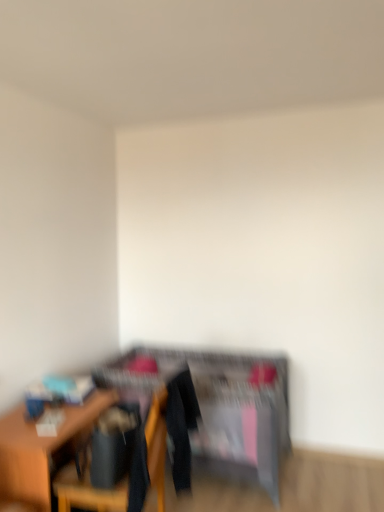
Question: Are wooden chair at lower left and wooden table at left making contact?

Choices:
 (A) no
 (B) yes

Answer: (A)

Question: Does wooden chair at lower left have a greater height compared to wooden table at left?

Choices:
 (A) no
 (B) yes

Answer: (A)

Question: Is wooden chair at lower left oriented towards wooden table at left?

Choices:
 (A) no
 (B) yes

Answer: (B)

Question: Is wooden chair at lower left positioned with its back to wooden table at left?

Choices:
 (A) yes
 (B) no

Answer: (B)

Question: Can you confirm if wooden chair at lower left is wider than wooden table at left?

Choices:
 (A) no
 (B) yes

Answer: (A)

Question: Can you confirm if wooden chair at lower left is positioned to the left of wooden table at left?

Choices:
 (A) no
 (B) yes

Answer: (A)

Question: Is wooden table at left located within wooden dresser at center?

Choices:
 (A) yes
 (B) no

Answer: (B)

Question: Can you confirm if wooden dresser at center is shorter than wooden table at left?

Choices:
 (A) no
 (B) yes

Answer: (A)

Question: From a real-world perspective, is wooden dresser at center located higher than wooden table at left?

Choices:
 (A) yes
 (B) no

Answer: (A)

Question: Are wooden dresser at center and wooden table at left beside each other?

Choices:
 (A) no
 (B) yes

Answer: (A)

Question: Is the depth of wooden dresser at center greater than that of wooden table at left?

Choices:
 (A) yes
 (B) no

Answer: (A)

Question: Does wooden dresser at center appear on the left side of wooden table at left?

Choices:
 (A) yes
 (B) no

Answer: (B)

Question: Is wooden chair at lower left far away from wooden dresser at center?

Choices:
 (A) no
 (B) yes

Answer: (A)